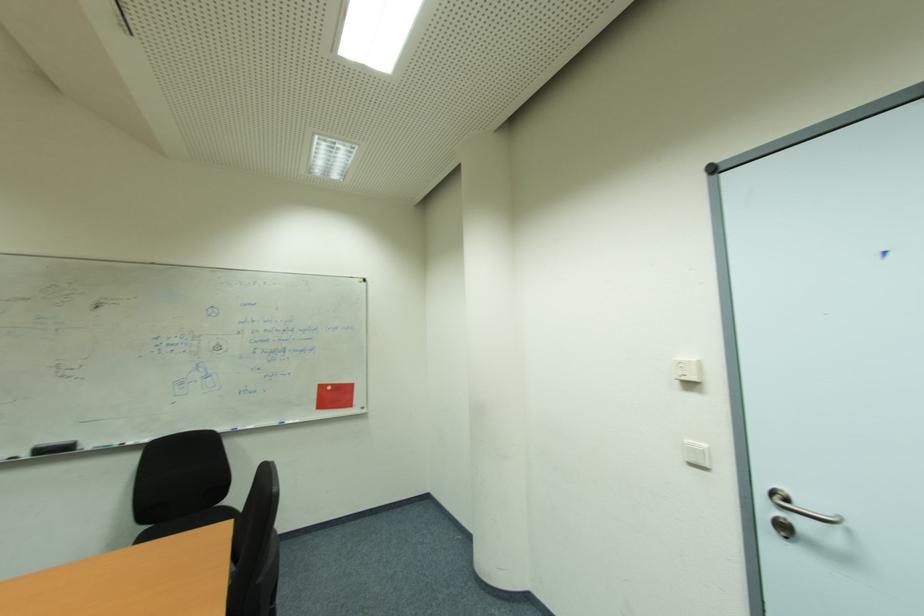
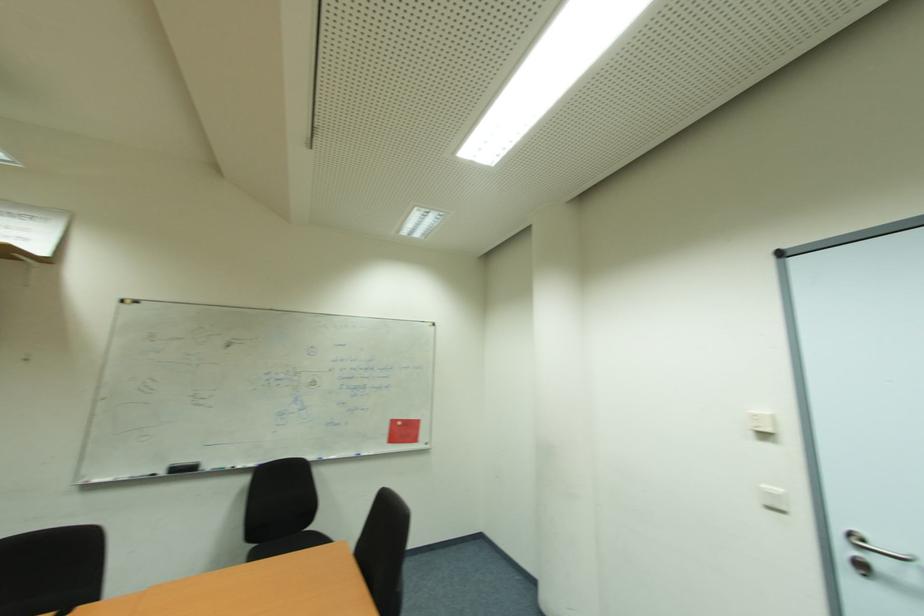
The point at (707, 446) is marked in the first image. Where is the corresponding point in the second image?

(784, 492)